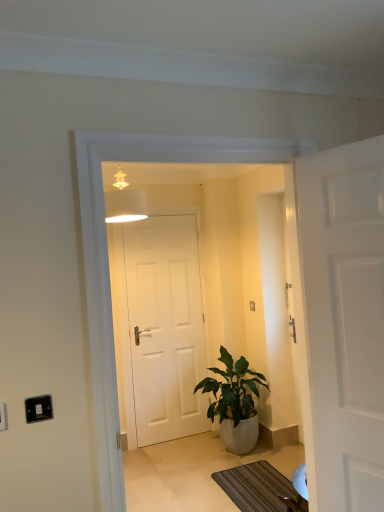
Measure the distance between point (127, 419) and camera.

The distance of point (127, 419) from camera is 3.61 meters.

In order to face green glossy plant at center, should I rotate leftwards or rightwards?

Turn right by 5.057 degrees to look at green glossy plant at center.

Identify the location of white plastic electric outlet at lower left, positioned as the 2th electric outlet in back-to-front order. (3, 416).

Image resolution: width=384 pixels, height=512 pixels. What do you see at coordinates (342, 323) in the screenshot?
I see `white matte door at right, the second door viewed from the left` at bounding box center [342, 323].

Find the location of `white matte door at center, the second door viewed from the front`. white matte door at center, the second door viewed from the front is located at coordinates (165, 327).

Looking at this image, who is smaller, white plastic electric outlet at lower left, positioned as the 1th electric outlet in left-to-right order, or black plastic switch at lower left, which appears as the second electric outlet when viewed from the left?

black plastic switch at lower left, which appears as the second electric outlet when viewed from the left.

Would you say white plastic electric outlet at lower left, which is the 1th electric outlet in front-to-back order, is a long distance from black plastic switch at lower left, the 1th electric outlet viewed from the right?

No, white plastic electric outlet at lower left, which is the 1th electric outlet in front-to-back order, is not far away from black plastic switch at lower left, the 1th electric outlet viewed from the right.

Considering the points (5, 413) and (42, 412), which point is in front, point (5, 413) or point (42, 412)?

The point (5, 413) is in front.

Can you tell me how much white plastic electric outlet at lower left, positioned as the 1th electric outlet in left-to-right order, and black plastic switch at lower left, which appears as the second electric outlet when viewed from the left, differ in facing direction?

There is a 2.18-degree angle between the facing directions of white plastic electric outlet at lower left, positioned as the 1th electric outlet in left-to-right order, and black plastic switch at lower left, which appears as the second electric outlet when viewed from the left.

You are a GUI agent. You are given a task and a screenshot of the screen. Output one action in this format:
    pyautogui.click(x=<x>, y=<y>)
    Task: Click on the 1st door counting from the right side of the white plastic electric outlet at lower left, positioned as the 1th electric outlet in left-to-right order
    Image resolution: width=384 pixels, height=512 pixels.
    Given the screenshot: What is the action you would take?
    pyautogui.click(x=165, y=327)

Consider the image. Which is more to the right, white plastic electric outlet at lower left, positioned as the 1th electric outlet in left-to-right order, or white matte door at center, the 1th door viewed from the left?

white matte door at center, the 1th door viewed from the left.

From a real-world perspective, between white plastic electric outlet at lower left, acting as the 2th electric outlet starting from the right, and white matte door at center, the 1th door positioned from the back, who is vertically lower?

white matte door at center, the 1th door positioned from the back, from a real-world perspective.

Is white plastic electric outlet at lower left, which is the 1th electric outlet in front-to-back order, thinner than white matte door at center, the 2th door positioned from the right?

Yes.

Considering the positions of objects white matte door at right, the first door positioned from the front, and white plastic electric outlet at lower left, positioned as the 1th electric outlet in left-to-right order, in the image provided, who is more to the left, white matte door at right, the first door positioned from the front, or white plastic electric outlet at lower left, positioned as the 1th electric outlet in left-to-right order,?

Positioned to the left is white plastic electric outlet at lower left, positioned as the 1th electric outlet in left-to-right order.

Identify the location of door above the white plastic electric outlet at lower left, positioned as the 2th electric outlet in back-to-front order (from a real-world perspective). (342, 323).

How many degrees apart are the facing directions of white matte door at right, which is counted as the first door, starting from the right, and white plastic electric outlet at lower left, positioned as the 2th electric outlet in back-to-front order?

The angle between the facing direction of white matte door at right, which is counted as the first door, starting from the right, and the facing direction of white plastic electric outlet at lower left, positioned as the 2th electric outlet in back-to-front order, is 69.1 degrees.

Do you think white matte door at right, which is counted as the first door, starting from the right, is within white plastic electric outlet at lower left, which is the 1th electric outlet in front-to-back order, or outside of it?

white matte door at right, which is counted as the first door, starting from the right, is not inside white plastic electric outlet at lower left, which is the 1th electric outlet in front-to-back order, it's outside.

Looking at their sizes, would you say black plastic switch at lower left, which appears as the second electric outlet when viewed from the left, is wider or thinner than white plastic electric outlet at lower left, positioned as the 2th electric outlet in back-to-front order?

black plastic switch at lower left, which appears as the second electric outlet when viewed from the left, is thinner than white plastic electric outlet at lower left, positioned as the 2th electric outlet in back-to-front order.

Considering the points (37, 403) and (0, 402), which point is in front, point (37, 403) or point (0, 402)?

Positioned in front is point (0, 402).

Could you tell me if black plastic switch at lower left, acting as the 1th electric outlet starting from the back, is turned towards white plastic electric outlet at lower left, positioned as the 2th electric outlet in back-to-front order?

No, black plastic switch at lower left, acting as the 1th electric outlet starting from the back, does not turn towards white plastic electric outlet at lower left, positioned as the 2th electric outlet in back-to-front order.

Is white matte door at right, the first door positioned from the front, further to the viewer compared to green glossy plant at center?

No, white matte door at right, the first door positioned from the front, is in front of green glossy plant at center.

Is white matte door at right, the first door positioned from the front, wider than green glossy plant at center?

No, white matte door at right, the first door positioned from the front, is not wider than green glossy plant at center.

Is white matte door at right, which is counted as the first door, starting from the right, to the left or to the right of green glossy plant at center in the image?

white matte door at right, which is counted as the first door, starting from the right, is positioned on green glossy plant at center's right side.

Can you tell me how much black plastic switch at lower left, the second electric outlet from the front, and striped fabric doormat at lower center differ in facing direction?

There is a 92.8-degree angle between the facing directions of black plastic switch at lower left, the second electric outlet from the front, and striped fabric doormat at lower center.

Is black plastic switch at lower left, the 1th electric outlet viewed from the right, with striped fabric doormat at lower center?

No, black plastic switch at lower left, the 1th electric outlet viewed from the right, is not touching striped fabric doormat at lower center.

Does black plastic switch at lower left, which appears as the second electric outlet when viewed from the left, have a greater height compared to striped fabric doormat at lower center?

Indeed, black plastic switch at lower left, which appears as the second electric outlet when viewed from the left, has a greater height compared to striped fabric doormat at lower center.

From a real-world perspective, is black plastic switch at lower left, the 1th electric outlet viewed from the right, on top of striped fabric doormat at lower center?

Yes, from a real-world perspective, black plastic switch at lower left, the 1th electric outlet viewed from the right, is above striped fabric doormat at lower center.

Based on the photo, is the position of white plastic electric outlet at lower left, positioned as the 1th electric outlet in left-to-right order, more distant than that of striped fabric doormat at lower center?

No, white plastic electric outlet at lower left, positioned as the 1th electric outlet in left-to-right order, is closer to the viewer.

From the image's perspective, starting from the striped fabric doormat at lower center, which electric outlet is the 1st one above? Please provide its 2D coordinates.

[(3, 416)]

In the scene shown: From the image's perspective, would you say white plastic electric outlet at lower left, positioned as the 1th electric outlet in left-to-right order, is positioned over striped fabric doormat at lower center?

Indeed, from the image's perspective, white plastic electric outlet at lower left, positioned as the 1th electric outlet in left-to-right order, is shown above striped fabric doormat at lower center.

Considering the relative positions of white plastic electric outlet at lower left, positioned as the 1th electric outlet in left-to-right order, and striped fabric doormat at lower center in the image provided, is white plastic electric outlet at lower left, positioned as the 1th electric outlet in left-to-right order, to the left or to the right of striped fabric doormat at lower center?

white plastic electric outlet at lower left, positioned as the 1th electric outlet in left-to-right order, is positioned on striped fabric doormat at lower center's left side.

You are a GUI agent. You are given a task and a screenshot of the screen. Output one action in this format:
    pyautogui.click(x=<x>, y=<y>)
    Task: Click on the electric outlet located underneath the black plastic switch at lower left, which appears as the second electric outlet when viewed from the left (from a real-world perspective)
    Image resolution: width=384 pixels, height=512 pixels.
    Given the screenshot: What is the action you would take?
    pyautogui.click(x=3, y=416)

This screenshot has width=384, height=512. I want to click on the 2nd electric outlet to the left of the white matte door at center, the 1th door viewed from the left, starting your count from the anchor, so click(3, 416).

Looking at the image, which one is located further to green glossy plant at center, black plastic switch at lower left, the second electric outlet from the front, or white plastic electric outlet at lower left, positioned as the 1th electric outlet in left-to-right order?

white plastic electric outlet at lower left, positioned as the 1th electric outlet in left-to-right order, is further to green glossy plant at center.

From the image, which object appears to be nearer to matte white lampshade at upper center, white matte door at center, the second door viewed from the front, or striped fabric doormat at lower center?

The object closer to matte white lampshade at upper center is white matte door at center, the second door viewed from the front.

Which object lies nearer to the anchor point black plastic switch at lower left, the 1th electric outlet viewed from the right, white matte door at right, the second door viewed from the left, or matte white lampshade at upper center?

A: The object closer to black plastic switch at lower left, the 1th electric outlet viewed from the right, is white matte door at right, the second door viewed from the left.

Which object lies further to the anchor point black plastic switch at lower left, which appears as the second electric outlet when viewed from the left, green glossy plant at center or matte white lampshade at upper center?

Among the two, green glossy plant at center is located further to black plastic switch at lower left, which appears as the second electric outlet when viewed from the left.

Looking at the image, which one is located closer to white plastic electric outlet at lower left, which is the 1th electric outlet in front-to-back order, white matte door at right, which is counted as the first door, starting from the right, or striped fabric doormat at lower center?

white matte door at right, which is counted as the first door, starting from the right.

Looking at the image, which one is located further to matte white lampshade at upper center, black plastic switch at lower left, which appears as the second electric outlet when viewed from the left, or white plastic electric outlet at lower left, acting as the 2th electric outlet starting from the right?

The object further to matte white lampshade at upper center is white plastic electric outlet at lower left, acting as the 2th electric outlet starting from the right.

Looking at the image, which one is located closer to green glossy plant at center, striped fabric doormat at lower center or matte white lampshade at upper center?

The object closer to green glossy plant at center is striped fabric doormat at lower center.

From the image, which object appears to be nearer to matte white lampshade at upper center, white matte door at right, the second door viewed from the left, or white plastic electric outlet at lower left, positioned as the 1th electric outlet in left-to-right order?

white matte door at right, the second door viewed from the left, lies closer to matte white lampshade at upper center than the other object.

This screenshot has width=384, height=512. In order to click on electric outlet between white plastic electric outlet at lower left, positioned as the 1th electric outlet in left-to-right order, and green glossy plant at center from front to back in this screenshot , I will do `click(38, 408)`.

The image size is (384, 512). I want to click on houseplant between striped fabric doormat at lower center and white matte door at center, the 1th door viewed from the left, in the front-back direction, so click(234, 402).

I want to click on doormat between white plastic electric outlet at lower left, positioned as the 2th electric outlet in back-to-front order, and white matte door at right, which is counted as the first door, starting from the right, from left to right, so click(260, 488).

Identify the location of doormat positioned between white plastic electric outlet at lower left, which is the 1th electric outlet in front-to-back order, and green glossy plant at center from near to far. The image size is (384, 512). (260, 488).